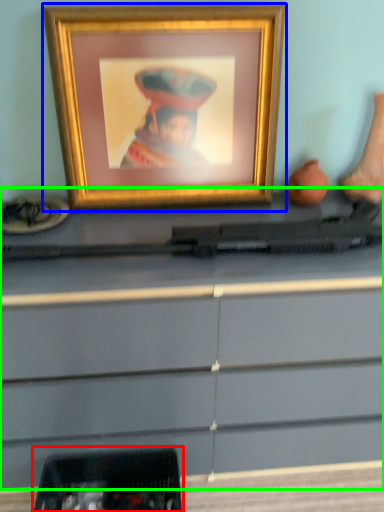
Question: Estimate the real-world distances between objects in this image. Which object is farther from equipment (highlighted by a red box), picture frame (highlighted by a blue box) or desk (highlighted by a green box)?

Choices:
 (A) picture frame
 (B) desk

Answer: (A)